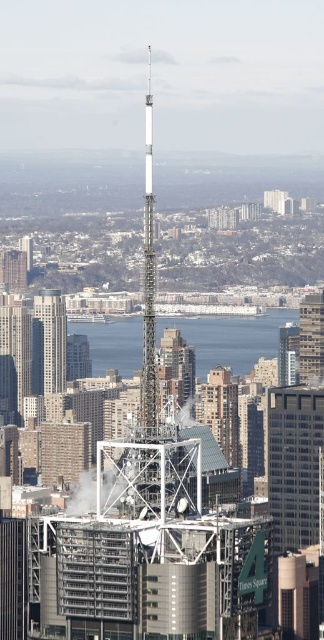
Question: Where is blue water at center located in relation to matte brown building at left in the image?

Choices:
 (A) above
 (B) below

Answer: (B)

Question: Which object appears closest to the camera in this image?

Choices:
 (A) matte brown building at left
 (B) white glass spire at center

Answer: (B)

Question: Which is nearer to the matte brown building at left?

Choices:
 (A) metallic silver tower at right
 (B) matte silver skyscraper at center
 (C) blue water at center
 (D) white glass spire at center

Answer: (B)

Question: In this image, where is white glass spire at center located relative to matte silver skyscraper at center?

Choices:
 (A) below
 (B) above

Answer: (B)

Question: Can you confirm if matte silver skyscraper at center is positioned to the left of matte brown building at left?

Choices:
 (A) yes
 (B) no

Answer: (B)

Question: Among these objects, which one is nearest to the camera?

Choices:
 (A) matte silver skyscraper at center
 (B) white glass spire at center

Answer: (B)